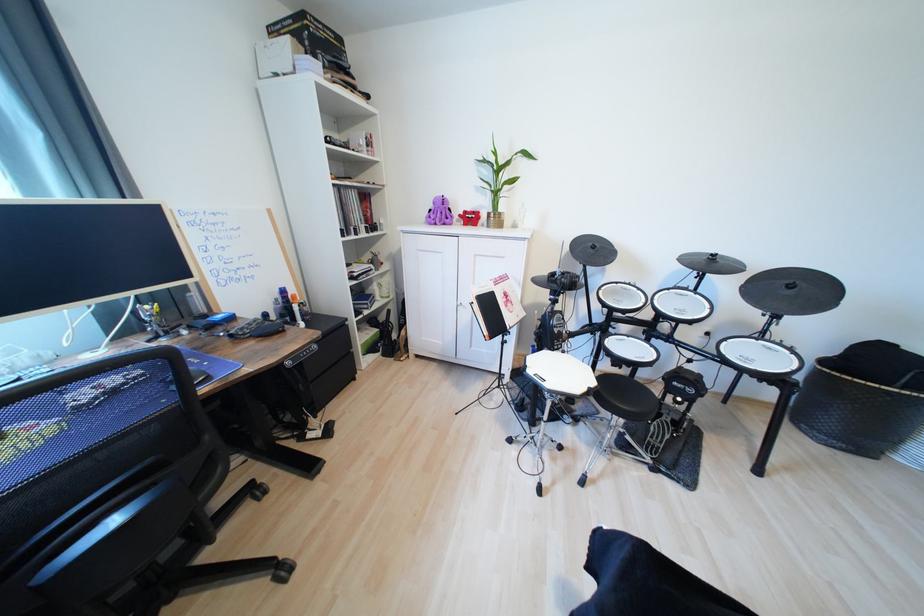
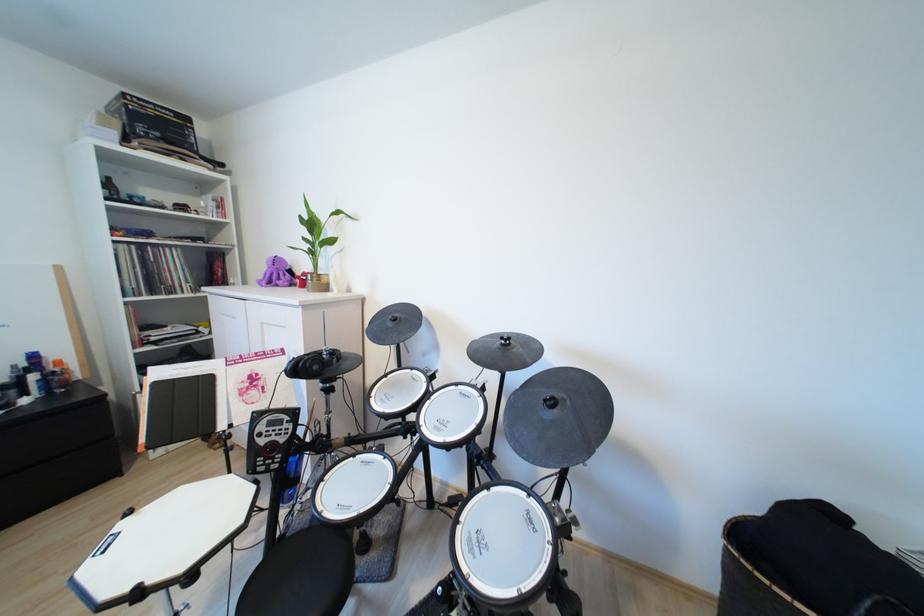
The point at (x=447, y=216) is marked in the first image. Where is the corresponding point in the second image?

(289, 277)